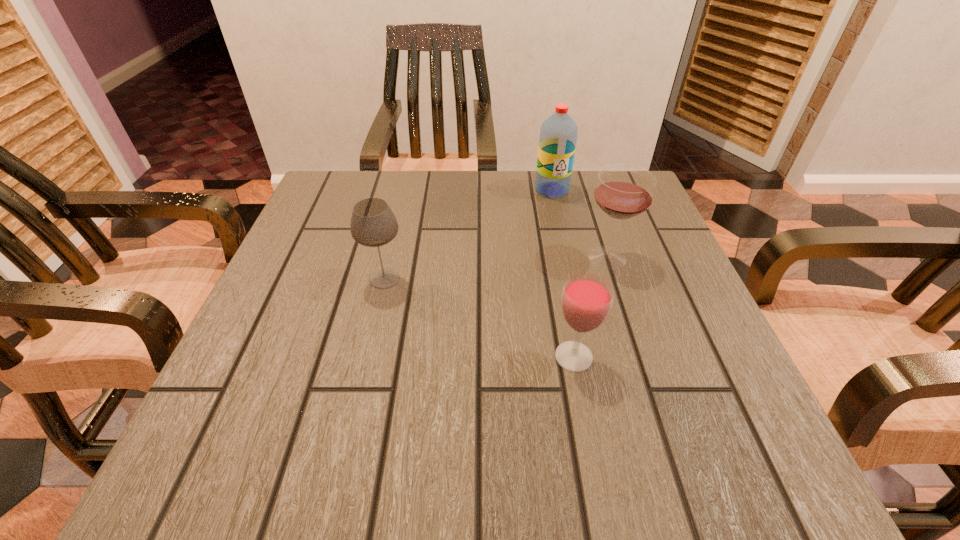
Image resolution: width=960 pixels, height=540 pixels. Find the location of `water bottle`. water bottle is located at coordinates (558, 136).

Where is `the rightmost wineglass`? the rightmost wineglass is located at coordinates (624, 191).

You are a GUI agent. You are given a task and a screenshot of the screen. Output one action in this format:
    pyautogui.click(x=<x>, y=<y>)
    Task: Click on the leftmost object
    The image size is (960, 540).
    Given the screenshot: What is the action you would take?
    pyautogui.click(x=373, y=224)

Find the location of a particular element. Image resolution: width=960 pixels, height=540 pixels. the nearest wineglass is located at coordinates (587, 298).

Find the location of a particular element. the nearest object is located at coordinates (587, 298).

This screenshot has height=540, width=960. I want to click on free region located on the front label of the water bottle, so click(x=581, y=320).

The image size is (960, 540). I want to click on blank space located on the back of the rightmost wineglass, so coord(588,199).

Find the location of a particular element. free region located 0.310m on the front of the leftmost object is located at coordinates (343, 458).

What are the coordinates of `free space located 0.200m on the back of the nearest object` in the screenshot? It's located at (556, 261).

The width and height of the screenshot is (960, 540). I want to click on object situated at the far edge, so click(558, 136).